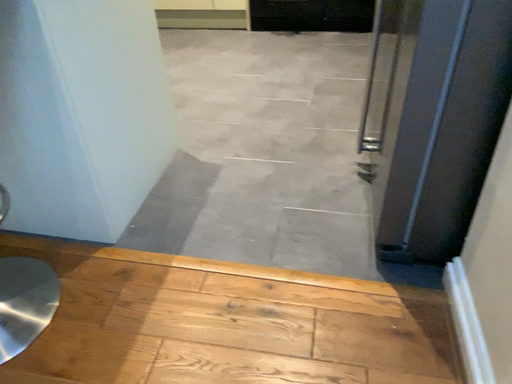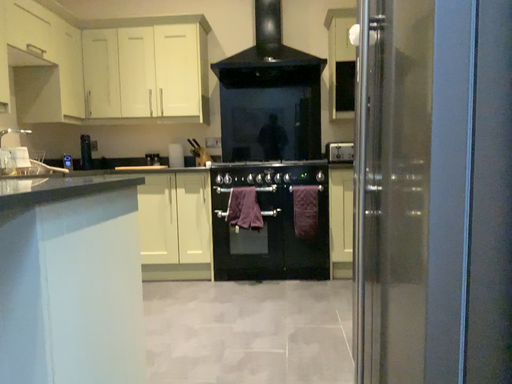
Question: Which way did the camera rotate in the video?

Choices:
 (A) rotated downward
 (B) rotated upward

Answer: (B)